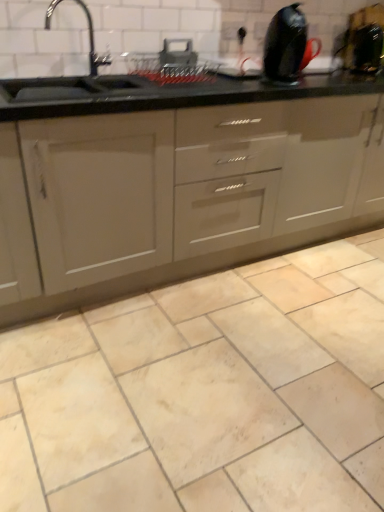
Question: Is black glossy kettle at upper right, the 4th appliance viewed from the left, in front of glossy black kettle at upper right, arranged as the 3th appliance when viewed from the left?

Choices:
 (A) yes
 (B) no

Answer: (B)

Question: Does black glossy kettle at upper right, which is the 1th appliance from right to left, have a smaller size compared to glossy black kettle at upper right, positioned as the 2th appliance in right-to-left order?

Choices:
 (A) no
 (B) yes

Answer: (B)

Question: Is there a large distance between black glossy kettle at upper right, which is the 1th appliance from right to left, and glossy black kettle at upper right, positioned as the 2th appliance in right-to-left order?

Choices:
 (A) yes
 (B) no

Answer: (B)

Question: From a real-world perspective, is black glossy kettle at upper right, the 4th appliance viewed from the left, on top of glossy black kettle at upper right, positioned as the 2th appliance in right-to-left order?

Choices:
 (A) yes
 (B) no

Answer: (B)

Question: Considering the relative sizes of black glossy kettle at upper right, which is the 1th appliance from right to left, and glossy black kettle at upper right, positioned as the 2th appliance in right-to-left order, in the image provided, is black glossy kettle at upper right, which is the 1th appliance from right to left, wider than glossy black kettle at upper right, positioned as the 2th appliance in right-to-left order,?

Choices:
 (A) no
 (B) yes

Answer: (A)

Question: Is black glossy kettle at upper right, the 4th appliance viewed from the left, oriented away from glossy black kettle at upper right, positioned as the 2th appliance in right-to-left order?

Choices:
 (A) no
 (B) yes

Answer: (A)

Question: From a real-world perspective, is glossy black kettle at upper right, positioned as the 2th appliance in right-to-left order, over metallic silver toaster at upper center, the 3th appliance viewed from the right?

Choices:
 (A) yes
 (B) no

Answer: (A)

Question: Is glossy black kettle at upper right, positioned as the 2th appliance in right-to-left order, far from metallic silver toaster at upper center, the 3th appliance viewed from the right?

Choices:
 (A) yes
 (B) no

Answer: (B)

Question: From the image's perspective, is glossy black kettle at upper right, positioned as the 2th appliance in right-to-left order, below metallic silver toaster at upper center, the 3th appliance viewed from the right?

Choices:
 (A) yes
 (B) no

Answer: (B)

Question: Can you confirm if glossy black kettle at upper right, positioned as the 2th appliance in right-to-left order, is shorter than metallic silver toaster at upper center, acting as the 2th appliance starting from the left?

Choices:
 (A) no
 (B) yes

Answer: (A)

Question: Is glossy black kettle at upper right, positioned as the 2th appliance in right-to-left order, aimed at metallic silver toaster at upper center, acting as the 2th appliance starting from the left?

Choices:
 (A) no
 (B) yes

Answer: (A)

Question: Can you confirm if glossy black kettle at upper right, arranged as the 3th appliance when viewed from the left, is positioned to the left of metallic silver toaster at upper center, acting as the 2th appliance starting from the left?

Choices:
 (A) no
 (B) yes

Answer: (A)

Question: Does beige marble tile at center have a greater height compared to matte gray cabinet at center?

Choices:
 (A) yes
 (B) no

Answer: (B)